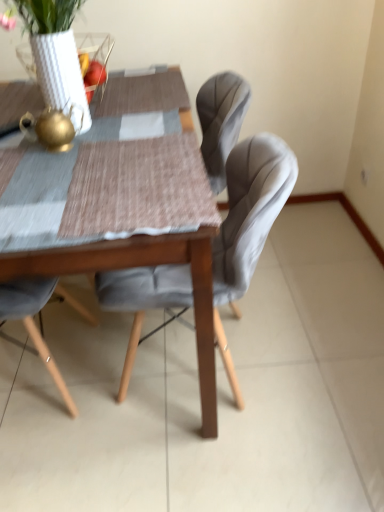
Question: Would you say velvet grey chair at center is to the left or to the right of wooden table at center in the picture?

Choices:
 (A) right
 (B) left

Answer: (A)

Question: Considering the positions of velvet grey chair at center and wooden table at center in the image, is velvet grey chair at center bigger or smaller than wooden table at center?

Choices:
 (A) big
 (B) small

Answer: (B)

Question: Which is farther from the velvet grey chair at center?

Choices:
 (A) wooden table at center
 (B) white textured vase at upper left

Answer: (B)

Question: Which of these objects is positioned farthest from the wooden table at center?

Choices:
 (A) velvet grey chair at center
 (B) white textured vase at upper left

Answer: (B)